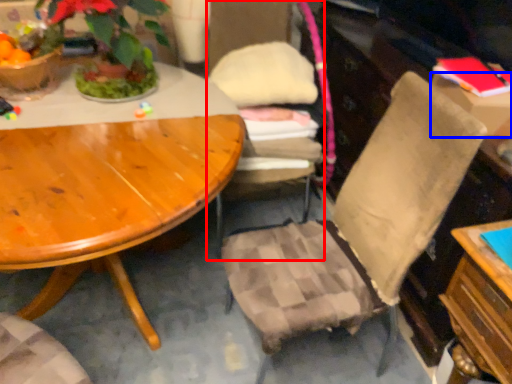
Question: Which point is further to the camera, chair (highlighted by a red box) or box (highlighted by a blue box)?

Choices:
 (A) chair
 (B) box

Answer: (A)